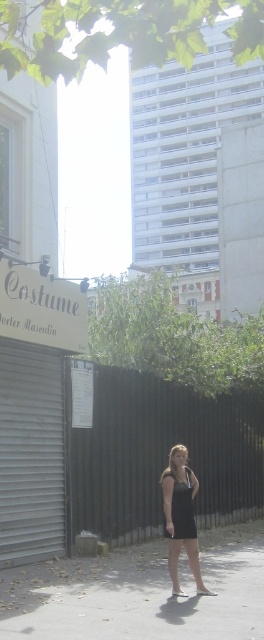
Question: Which point is closer to the camera?

Choices:
 (A) black dress at center
 (B) gray concrete pavement at lower center
 (C) black satin dress at center
 (D) white matte sign at upper left

Answer: (B)

Question: Estimate the real-world distances between objects in this image. Which object is farther from the black dress at center?

Choices:
 (A) black satin dress at center
 (B) white matte sign at upper left
 (C) gray concrete pavement at lower center

Answer: (B)

Question: Can you confirm if black dress at center is wider than black satin dress at center?

Choices:
 (A) yes
 (B) no

Answer: (A)

Question: Can you confirm if white matte sign at upper left is positioned to the right of black dress at center?

Choices:
 (A) yes
 (B) no

Answer: (B)

Question: Which is nearer to the black satin dress at center?

Choices:
 (A) black dress at center
 (B) gray concrete pavement at lower center

Answer: (A)

Question: Can you confirm if white matte sign at upper left is wider than black dress at center?

Choices:
 (A) no
 (B) yes

Answer: (B)